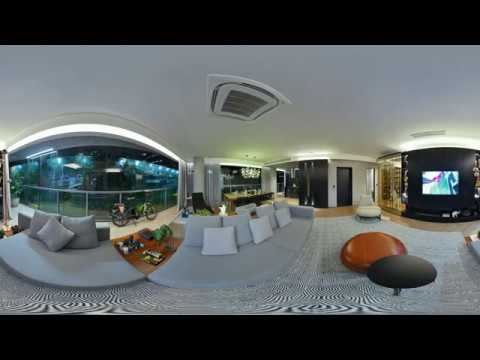
Where is `ceiling`? The image size is (480, 360). ceiling is located at coordinates (144, 80).